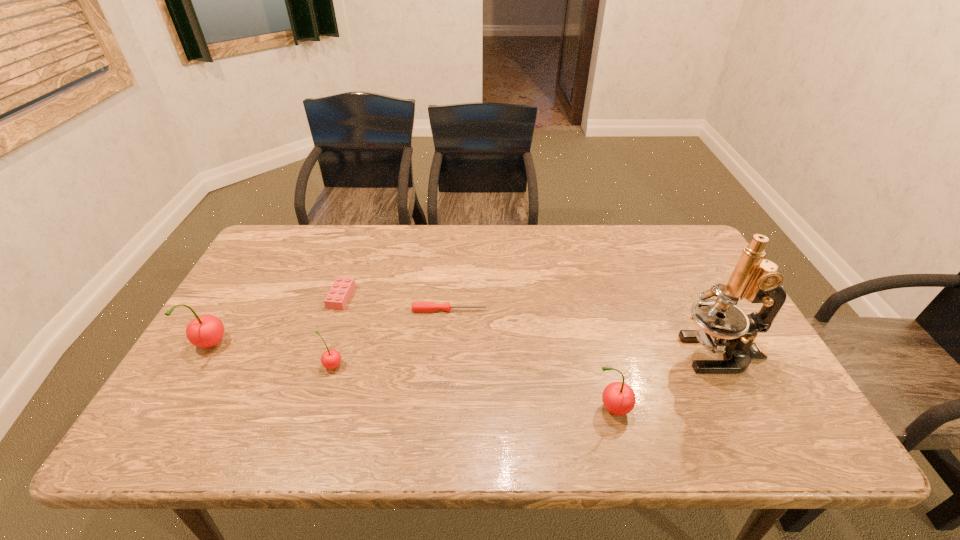
To achieve uniform spacing by inserting another cherry among them, please point to a free space for this new cherry. Please provide its 2D coordinates. Your answer should be formatted as a tuple, i.e. [(x, y)], where the tuple contains the x and y coordinates of a point satisfying the conditions above.

[(466, 386)]